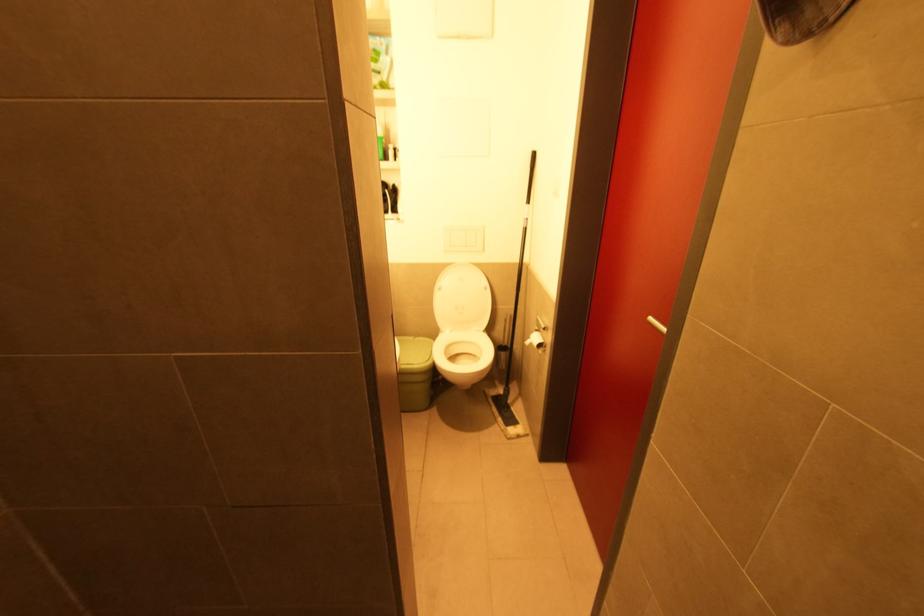
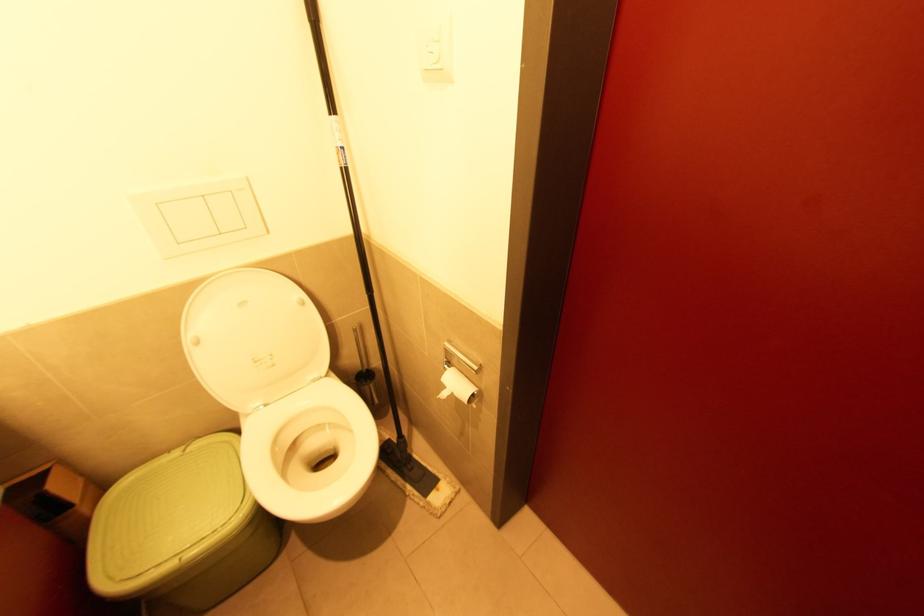
From the picture: How did the camera likely rotate?

The camera rotated toward right-down.